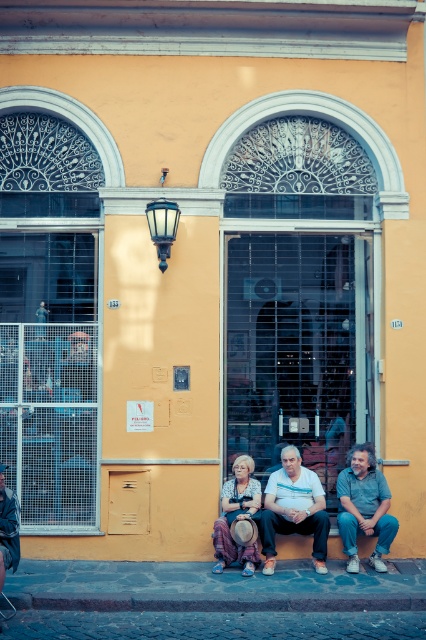
You are a passerby standing in front of the yellow building. You see a striped fabric dress at center and a denim jacket at lower left. Which item is positioned lower on the wall?

The striped fabric dress at center is below denim jacket at lower left, so the striped fabric dress at center is positioned lower on the wall.

You are standing on the street in front of the yellow building. You see a striped fabric dress at center and a denim jacket at lower left. Which item is closer to you?

The striped fabric dress at center is closer to you because it is further to the viewer than the denim jacket at lower left.

What is the exact coordinate of the white cotton shirt at center?

The white cotton shirt at center is located at coordinate point (293, 508).